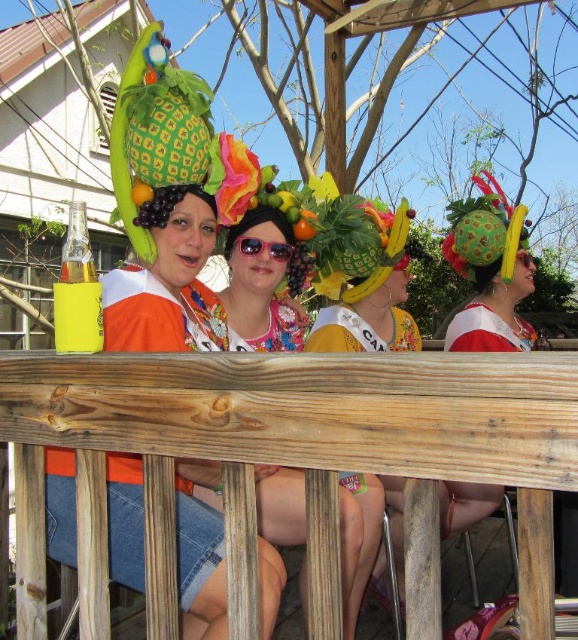
Who is more forward, (x=264, y=244) or (x=144, y=202)?

Point (x=144, y=202) is more forward.

Does point (290, 248) come closer to viewer compared to point (143, 186)?

That is False.

You are a GUI agent. You are given a task and a screenshot of the screen. Output one action in this format:
    pyautogui.click(x=<x>, y=<y>)
    Task: Click on the pink plastic sunglasses at center
    
    Given the screenshot: What is the action you would take?
    pyautogui.click(x=264, y=248)

Is yellow matte cup at lower left to the right of orange matte at upper center from the viewer's perspective?

Indeed, yellow matte cup at lower left is positioned on the right side of orange matte at upper center.

Is yellow matte cup at lower left wider than orange matte at upper center?

Yes.

What do you see at coordinates (140, 314) in the screenshot? This screenshot has width=578, height=640. I see `yellow matte cup at lower left` at bounding box center [140, 314].

You are a GUI agent. You are given a task and a screenshot of the screen. Output one action in this format:
    pyautogui.click(x=<x>, y=<y>)
    Task: Click on the yellow matte cup at lower left
    
    Given the screenshot: What is the action you would take?
    pyautogui.click(x=140, y=314)

Is floral fabric dress at center to the left of matte floral dress at center from the viewer's perspective?

In fact, floral fabric dress at center is to the right of matte floral dress at center.

Which is below, floral fabric dress at center or matte floral dress at center?

floral fabric dress at center is lower down.

Does point (350, 572) come farther from viewer compared to point (272, 250)?

No.

At what (x,y) coordinates should I click in order to perform the action: click on floral fabric dress at center. Please return your answer as a coordinate pair (x, y). The width and height of the screenshot is (578, 640). Looking at the image, I should click on (260, 291).